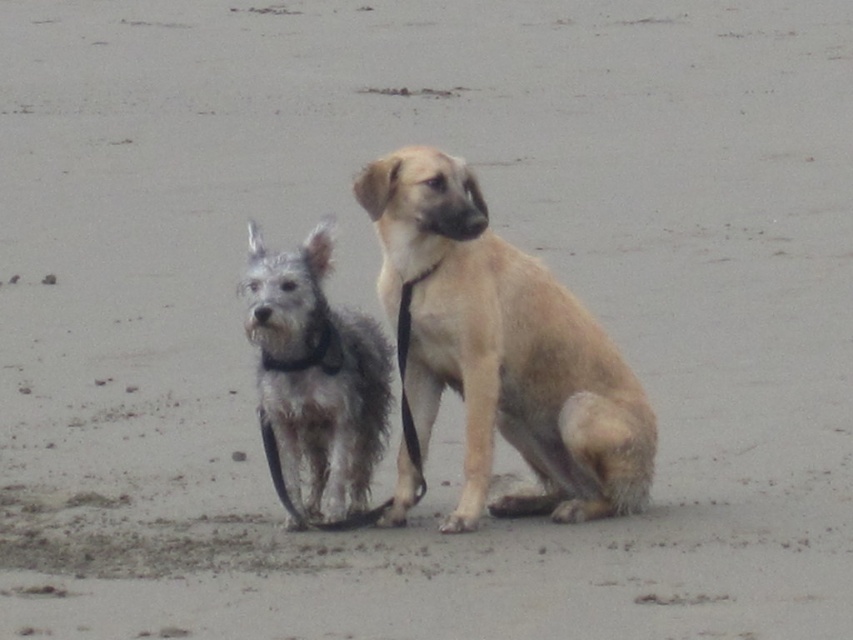
Question: Which object appears closest to the camera in this image?

Choices:
 (A) fuzzy gray dog at center
 (B) light brown fur dog at center

Answer: (B)

Question: Which object appears farthest from the camera in this image?

Choices:
 (A) fuzzy gray dog at center
 (B) light brown fur dog at center

Answer: (A)

Question: Is the position of light brown fur dog at center less distant than that of fuzzy gray dog at center?

Choices:
 (A) no
 (B) yes

Answer: (B)

Question: Is light brown fur dog at center bigger than fuzzy gray dog at center?

Choices:
 (A) yes
 (B) no

Answer: (A)

Question: Can you confirm if light brown fur dog at center is positioned below fuzzy gray dog at center?

Choices:
 (A) yes
 (B) no

Answer: (A)